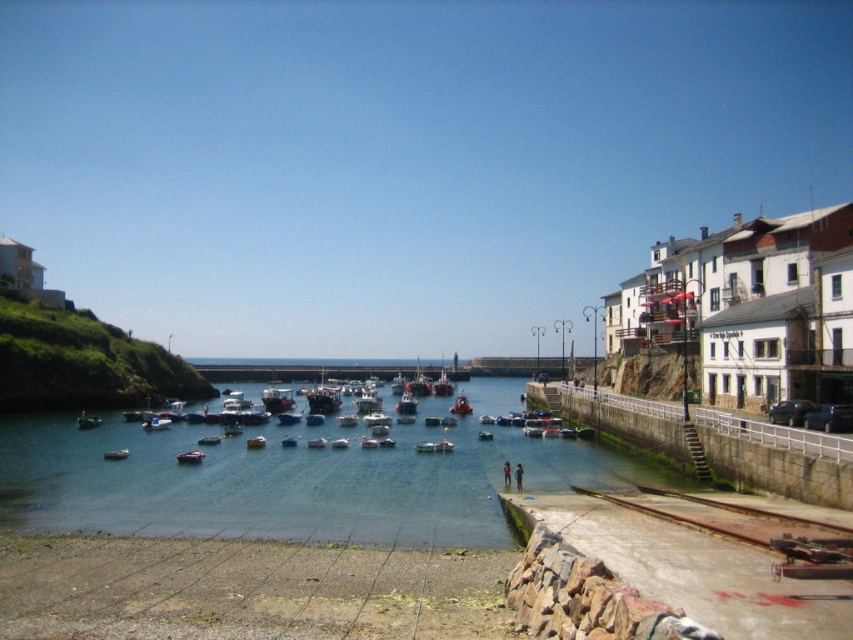
Question: Can you confirm if metallic silver boat at center is positioned above white matte boat at center?

Choices:
 (A) no
 (B) yes

Answer: (B)

Question: Which object is positioned farthest from the metallic silver boat at center?

Choices:
 (A) metallic silver boat at lower left
 (B) metallic gray boat at lower left
 (C) metallic gold boat at center
 (D) blue matte boat at center

Answer: (B)

Question: Is orange fiberglass boat at center to the right of metallic gold boat at center from the viewer's perspective?

Choices:
 (A) no
 (B) yes

Answer: (B)

Question: Which of these objects is positioned farthest from the blue matte boat at center?

Choices:
 (A) metallic silver boat at center
 (B) white matte boat at center
 (C) metallic silver boat at lower left
 (D) metallic gray boat at lower left

Answer: (B)

Question: Among these objects, which one is farthest from the camera?

Choices:
 (A) blue matte boat at center
 (B) metallic gray boat at lower left
 (C) white plastic boat at center
 (D) white matte boat at center

Answer: (A)

Question: Is metallic gray boat at lower left positioned in front of metallic gold boat at center?

Choices:
 (A) no
 (B) yes

Answer: (A)